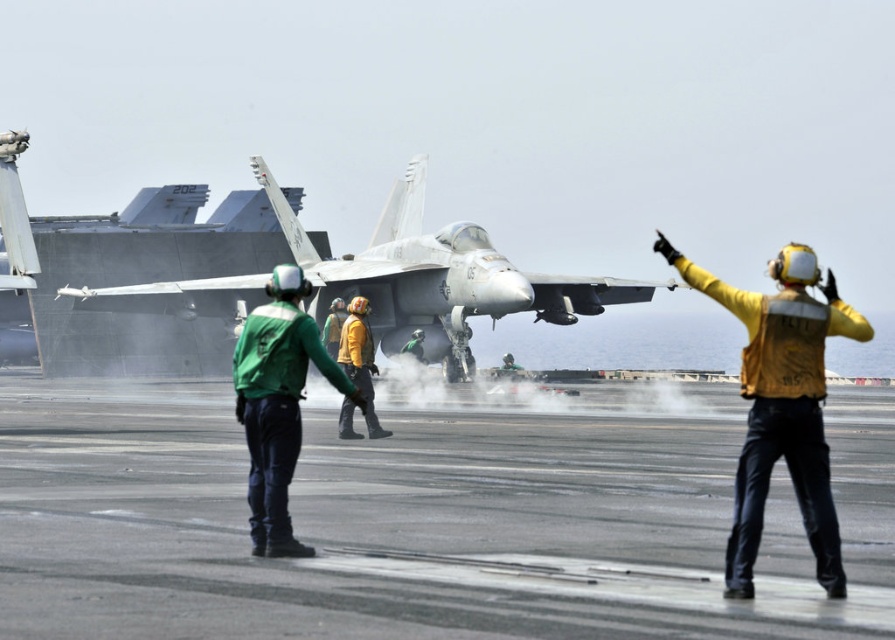
You are a pilot preparing to board your aircraft on the aircraft carrier. You see the white matte fighter jet at center and the yellow fabric helmet at center. Which object is closer to you as you approach the flight deck?

The white matte fighter jet at center is closer to you because the yellow fabric helmet at center is positioned behind it.

You are a safety inspector on the aircraft carrier and need to ensure that the green fabric uniform at center and the yellow fabric helmet at center meet the minimum size requirements for visibility. According to the provided description, which of the two items is smaller in size?

The green fabric uniform at center is smaller in size compared to the yellow fabric helmet at center, so it may not meet the minimum size requirements for visibility.

You are standing on the flight deck of an aircraft carrier and want to reach a specific point marked at coordinates point (311, 246). If your current position is 100 feet away from the viewer, can you safely walk to that point without crossing into restricted areas?

The point (311, 246) is 111.25 feet away from the viewer. Since you are currently 100 feet away from the viewer, you would need to move an additional 11.25 feet forward to reach it. However, aircraft carrier flight decks have strict safety protocols, and moving towards the aircraft or active areas could be hazardous. Ensure you have proper clearance and follow all safety guidelines before proceeding.